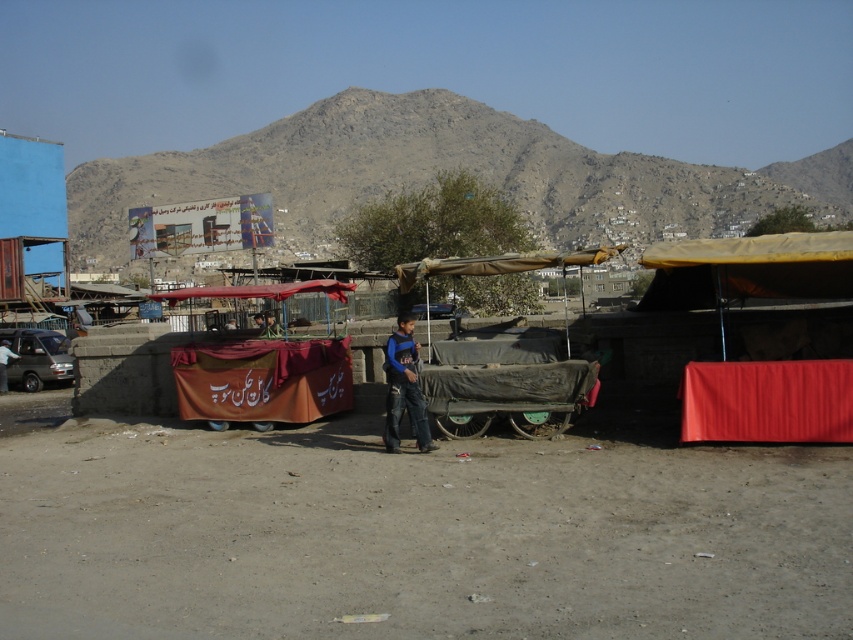
Question: Does gray rocky mountain at upper center lie in front of metallic gray van at left?

Choices:
 (A) no
 (B) yes

Answer: (A)

Question: Which object is the farthest from the dirt field at lower center?

Choices:
 (A) blue matte shirt at center
 (B) gray rocky mountain at upper center
 (C) dark blue jeans at center
 (D) metallic gray van at left

Answer: (B)

Question: Where is dirt field at lower center located in relation to metallic gray van at left in the image?

Choices:
 (A) right
 (B) left

Answer: (A)

Question: Which object is the farthest from the metallic gray van at left?

Choices:
 (A) blue matte shirt at center
 (B) dark blue jeans at center
 (C) dirt field at lower center

Answer: (A)

Question: Is dirt field at lower center further to the viewer compared to dark blue jeans at center?

Choices:
 (A) yes
 (B) no

Answer: (B)

Question: Estimate the real-world distances between objects in this image. Which object is farther from the gray rocky mountain at upper center?

Choices:
 (A) dirt field at lower center
 (B) metallic gray van at left
 (C) blue matte shirt at center

Answer: (C)